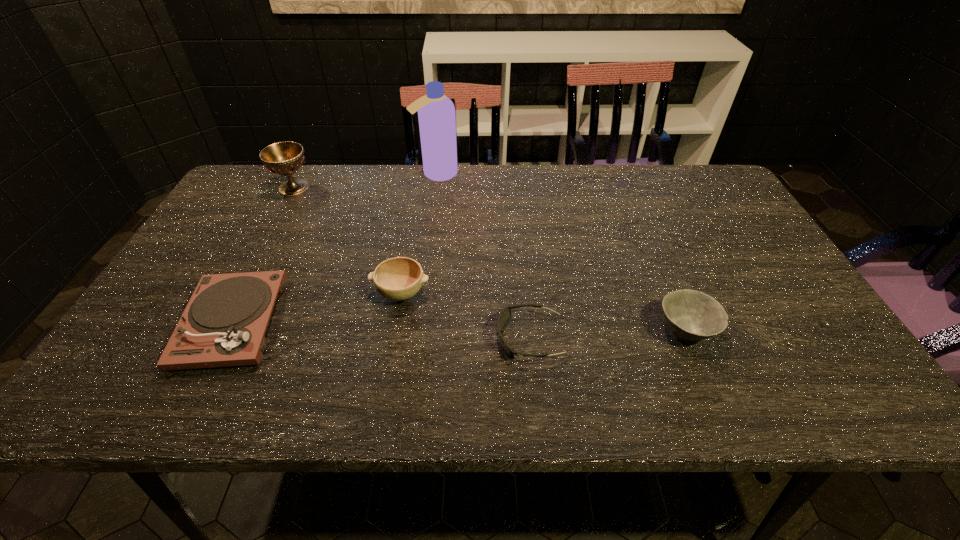
Locate an element on the screen. The image size is (960, 540). the tallest object is located at coordinates (436, 113).

What are the coordinates of `the second tallest object` in the screenshot? It's located at (284, 158).

The height and width of the screenshot is (540, 960). What are the coordinates of `the left bowl` in the screenshot? It's located at (400, 278).

Find the location of a particular element. The image size is (960, 540). the right bowl is located at coordinates (691, 315).

Identify the location of phonograph_record. (224, 323).

Identify the location of goggles. This screenshot has height=540, width=960. (504, 316).

This screenshot has height=540, width=960. Find the location of `the shortest object`. the shortest object is located at coordinates (504, 316).

This screenshot has width=960, height=540. Find the location of `free space located 0.300m on the front of the shampoo`. free space located 0.300m on the front of the shampoo is located at coordinates (427, 246).

The width and height of the screenshot is (960, 540). I want to click on free region located 0.350m on the right of the chalice, so click(x=426, y=188).

Image resolution: width=960 pixels, height=540 pixels. In order to click on vacant space located on the front of the left bowl in this screenshot , I will do `click(386, 380)`.